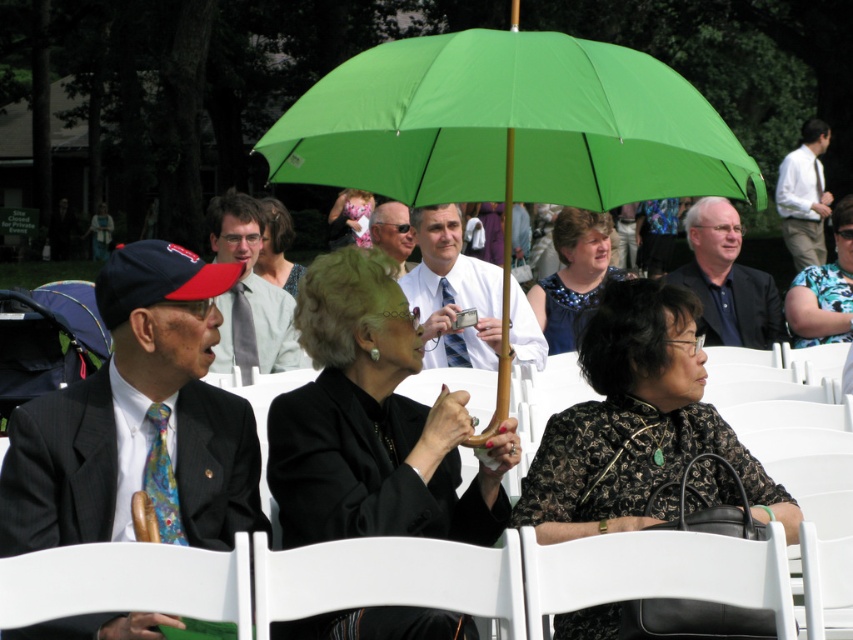
Question: Which of these objects is positioned farthest from the floral print blouse at center?

Choices:
 (A) dark blue shirt at center
 (B) black fabric jacket at center
 (C) black textured blouse at center

Answer: (B)

Question: Is white plastic chair at lower center smaller than matte white shirt at center?

Choices:
 (A) yes
 (B) no

Answer: (A)

Question: Is black fabric jacket at center above matte pink dress at center?

Choices:
 (A) no
 (B) yes

Answer: (A)

Question: Among these points, which one is nearest to the camera?

Choices:
 (A) (281, 205)
 (B) (448, 349)
 (C) (700, 230)
 (D) (599, 474)

Answer: (D)

Question: Is black fabric jacket at center further to the viewer compared to black textured blouse at center?

Choices:
 (A) yes
 (B) no

Answer: (B)

Question: Which point is closer to the camera taking this photo?

Choices:
 (A) (567, 205)
 (B) (738, 240)
 (C) (294, 579)

Answer: (C)